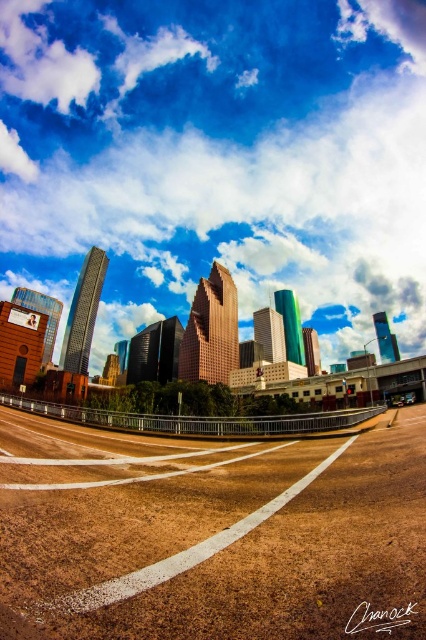
Question: Is white fluffy cloud at upper center bigger than brown gravel highway at lower center?

Choices:
 (A) no
 (B) yes

Answer: (B)

Question: Which point is farther from the camera taking this photo?

Choices:
 (A) (48, 556)
 (B) (250, 77)

Answer: (B)

Question: Can you confirm if white fluffy cloud at upper center is positioned to the left of brown gravel highway at lower center?

Choices:
 (A) yes
 (B) no

Answer: (B)

Question: Among these points, which one is farthest from the camera?

Choices:
 (A) (23, 243)
 (B) (287, 547)

Answer: (A)

Question: Is white fluffy cloud at upper center thinner than brown gravel highway at lower center?

Choices:
 (A) yes
 (B) no

Answer: (B)